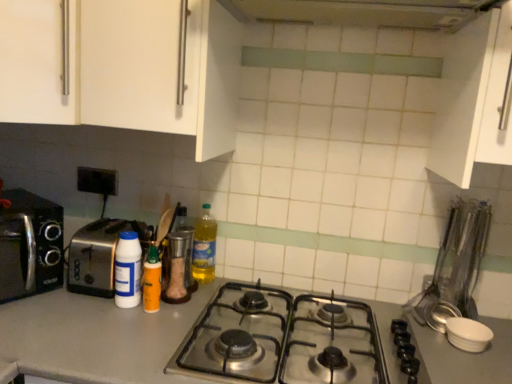
Where is `blank space to the left of orange matte squeeze bottle at center, placed as the third bottle when sorted from right to left`? The image size is (512, 384). blank space to the left of orange matte squeeze bottle at center, placed as the third bottle when sorted from right to left is located at coordinates (80, 308).